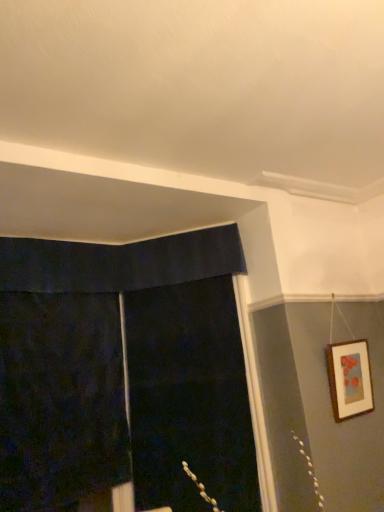
Question: Are black fabric screen door at center and dark velvet curtain at left far apart?

Choices:
 (A) yes
 (B) no

Answer: (B)

Question: From the image's perspective, is black fabric screen door at center above dark velvet curtain at left?

Choices:
 (A) no
 (B) yes

Answer: (B)

Question: Is black fabric screen door at center in front of dark velvet curtain at left?

Choices:
 (A) yes
 (B) no

Answer: (B)

Question: Is black fabric screen door at center with dark velvet curtain at left?

Choices:
 (A) no
 (B) yes

Answer: (A)

Question: Considering the relative sizes of black fabric screen door at center and dark velvet curtain at left in the image provided, is black fabric screen door at center shorter than dark velvet curtain at left?

Choices:
 (A) yes
 (B) no

Answer: (B)

Question: Is black fabric screen door at center surrounding dark velvet curtain at left?

Choices:
 (A) no
 (B) yes

Answer: (A)

Question: Is black fabric screen door at center facing away from wooden picture frame at upper right?

Choices:
 (A) yes
 (B) no

Answer: (B)

Question: Is black fabric screen door at center not within wooden picture frame at upper right?

Choices:
 (A) yes
 (B) no

Answer: (A)

Question: Is black fabric screen door at center further to camera compared to wooden picture frame at upper right?

Choices:
 (A) no
 (B) yes

Answer: (B)

Question: Can you see black fabric screen door at center touching wooden picture frame at upper right?

Choices:
 (A) yes
 (B) no

Answer: (B)

Question: Is black fabric screen door at center closer to the viewer compared to wooden picture frame at upper right?

Choices:
 (A) yes
 (B) no

Answer: (B)

Question: Could you tell me if black fabric screen door at center is turned towards wooden picture frame at upper right?

Choices:
 (A) no
 (B) yes

Answer: (A)

Question: From the image's perspective, is wooden picture frame at upper right on black fabric screen door at center?

Choices:
 (A) no
 (B) yes

Answer: (B)